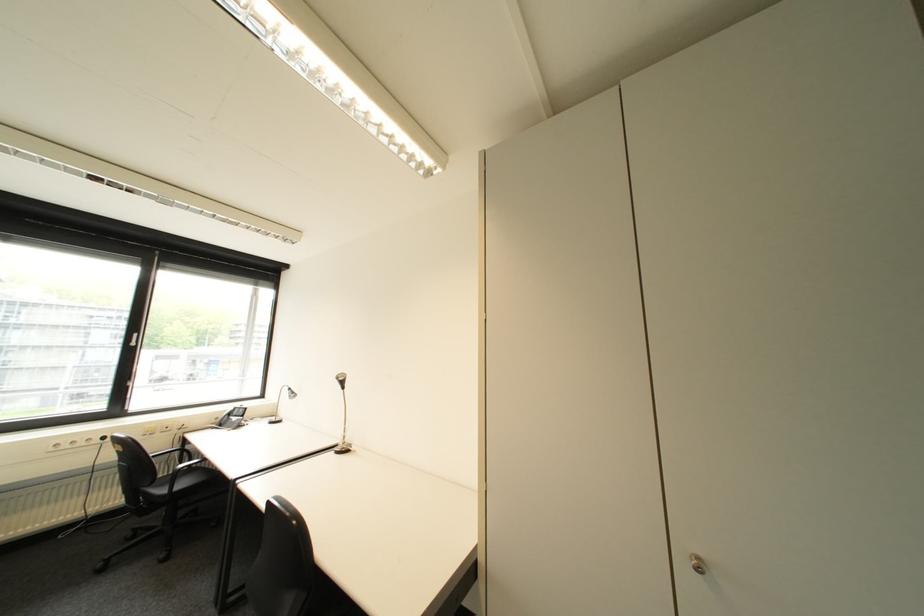
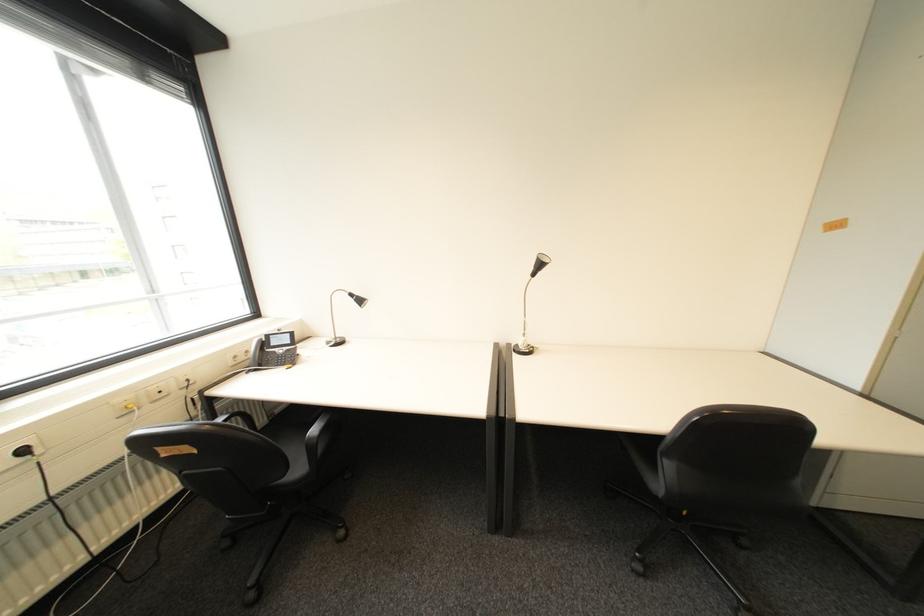
Find the pixel in the second image that matches (114,439) in the first image.

(34, 452)